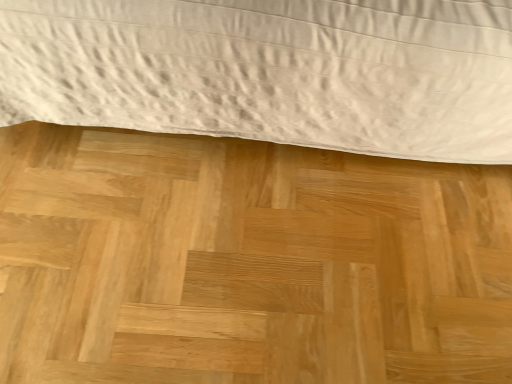
The height and width of the screenshot is (384, 512). Find the location of `free space above natural wood plywood at center (from a real-world perspective)`. free space above natural wood plywood at center (from a real-world perspective) is located at coordinates (249, 246).